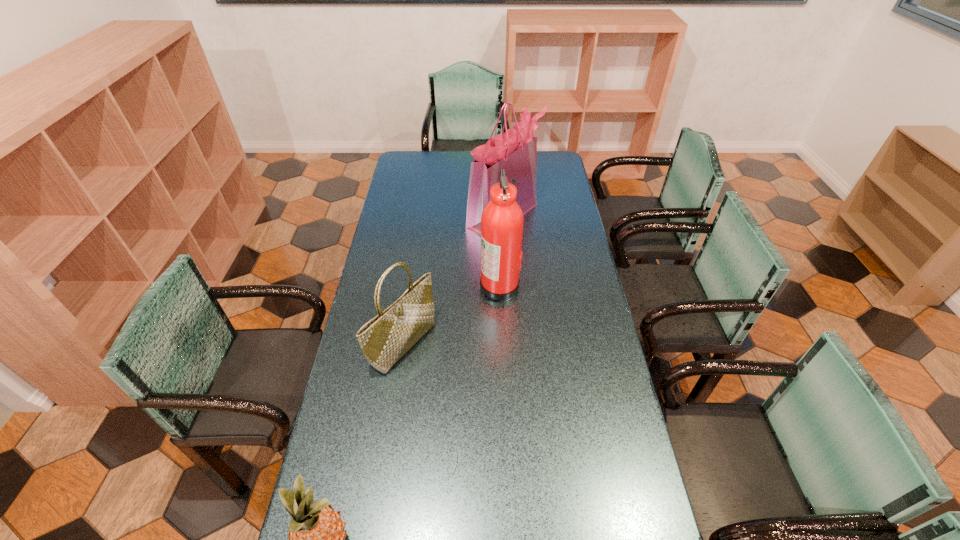
The height and width of the screenshot is (540, 960). I want to click on the farthest object, so click(515, 151).

Locate an element on the screen. This screenshot has height=540, width=960. the right shopping bag is located at coordinates (515, 151).

You are a GUI agent. You are given a task and a screenshot of the screen. Output one action in this format:
    pyautogui.click(x=<x>, y=<y>)
    Task: Click on the second farthest object
    This screenshot has height=540, width=960.
    Given the screenshot: What is the action you would take?
    pyautogui.click(x=502, y=219)

Where is `the nearer shopping bag`? The image size is (960, 540). the nearer shopping bag is located at coordinates (384, 339).

Identify the location of the left shopping bag. (384, 339).

This screenshot has height=540, width=960. In order to click on free space located on the back of the taller shopping bag in this screenshot , I will do `click(499, 153)`.

The height and width of the screenshot is (540, 960). Identify the location of vacant area situated 0.340m on the label side of the fire extinguisher. (394, 285).

What are the coordinates of `free spot located on the label side of the fire extinguisher` in the screenshot? It's located at (439, 285).

The width and height of the screenshot is (960, 540). I want to click on free space located 0.170m on the label side of the fire extinguisher, so click(x=437, y=285).

Identify the location of vacant area situated on the front of the third farthest object. (379, 505).